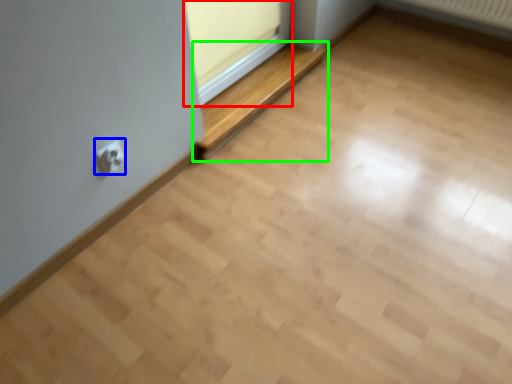
Question: Estimate the real-world distances between objects in this image. Which object is closer to window frame (highlighted by a red box), electric outlet (highlighted by a blue box) or balustrade (highlighted by a green box)?

Choices:
 (A) electric outlet
 (B) balustrade

Answer: (B)